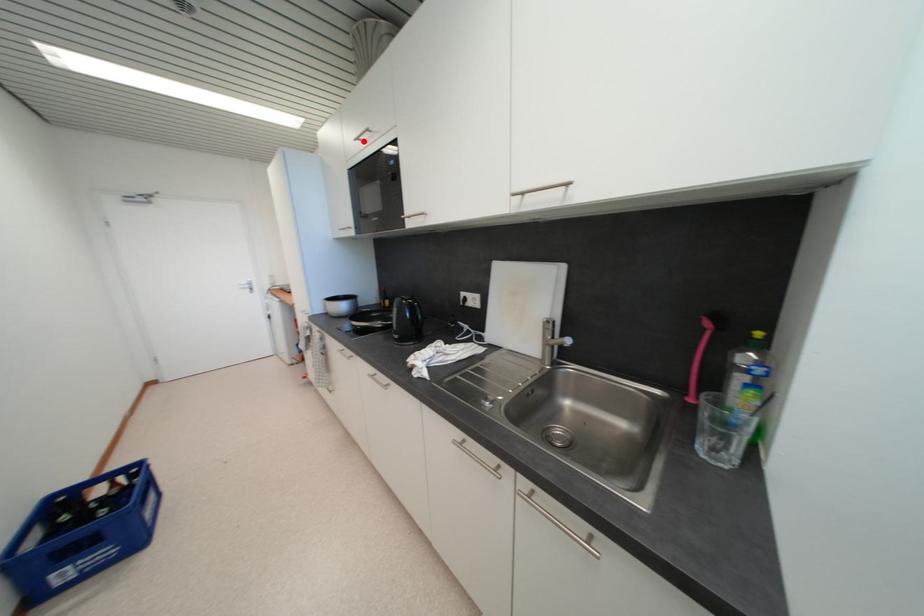
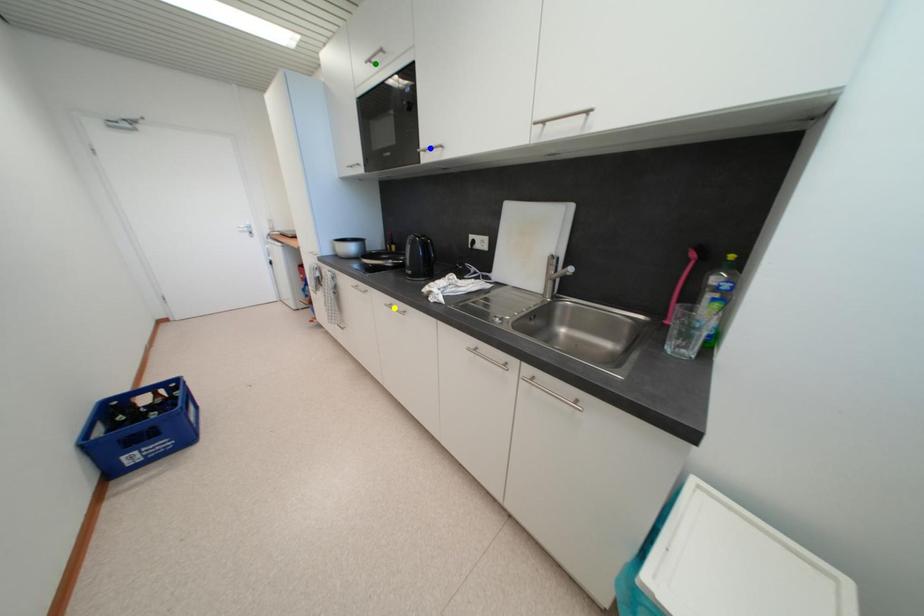
Question: I am providing you with two images of the same scene from different viewpoints. A red point is marked on the first image. You are given multiple points on the second image. In image 2, which mark is for the same physical point as the one in image 1?

Choices:
 (A) blue point
 (B) yellow point
 (C) green point

Answer: (C)